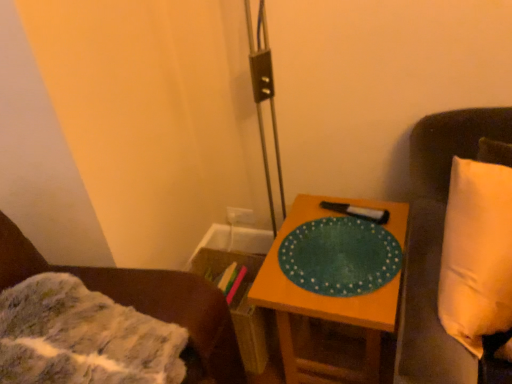
The image size is (512, 384). What are the coordinates of `white fabric pillow at right, which ranks as the second furniture in left-to-right order` in the screenshot? It's located at (437, 244).

Image resolution: width=512 pixels, height=384 pixels. I want to click on white fabric pillow at right, which is the 1th furniture in right-to-left order, so click(x=437, y=244).

Considering the sizes of objects white fabric pillow at right, which ranks as the second furniture in left-to-right order, and green matte placemat at center in the image provided, who is wider, white fabric pillow at right, which ranks as the second furniture in left-to-right order, or green matte placemat at center?

With larger width is green matte placemat at center.

Which is more to the left, white fabric pillow at right, which ranks as the second furniture in left-to-right order, or green matte placemat at center?

From the viewer's perspective, green matte placemat at center appears more on the left side.

From a real-world perspective, who is located lower, white fabric pillow at right, which ranks as the second furniture in left-to-right order, or green matte placemat at center?

green matte placemat at center is physically lower.

From the image's perspective, is white fabric pillow at right, which is the 1th furniture in right-to-left order, located above green matte placemat at center?

Yes, from the image's perspective, white fabric pillow at right, which is the 1th furniture in right-to-left order, is over green matte placemat at center.

Considering the relative sizes of fuzzy fabric blanket at lower left, which appears as the 2th furniture when viewed from the right, and green matte platter at center-right in the image provided, is fuzzy fabric blanket at lower left, which appears as the 2th furniture when viewed from the right, bigger than green matte platter at center-right?

Indeed, fuzzy fabric blanket at lower left, which appears as the 2th furniture when viewed from the right, has a larger size compared to green matte platter at center-right.

From the image's perspective, between fuzzy fabric blanket at lower left, which appears as the 2th furniture when viewed from the right, and green matte platter at center-right, who is located below?

fuzzy fabric blanket at lower left, which appears as the 2th furniture when viewed from the right, is shown below in the image.

Is fuzzy fabric blanket at lower left, which appears as the 2th furniture when viewed from the right, facing away from green matte platter at center-right?

No.

Is green matte platter at center-right not near fuzzy fabric blanket at lower left, which appears as the 2th furniture when viewed from the right?

No, green matte platter at center-right is in close proximity to fuzzy fabric blanket at lower left, which appears as the 2th furniture when viewed from the right.

Does green matte platter at center-right have a smaller size compared to fuzzy fabric blanket at lower left, which appears as the 1th furniture when viewed from the left?

Correct, green matte platter at center-right occupies less space than fuzzy fabric blanket at lower left, which appears as the 1th furniture when viewed from the left.

Is green matte platter at center-right aimed at fuzzy fabric blanket at lower left, which appears as the 1th furniture when viewed from the left?

No, green matte platter at center-right does not turn towards fuzzy fabric blanket at lower left, which appears as the 1th furniture when viewed from the left.

In terms of height, does green matte platter at center-right look taller or shorter compared to fuzzy fabric blanket at lower left, which appears as the 2th furniture when viewed from the right?

Clearly, green matte platter at center-right is shorter compared to fuzzy fabric blanket at lower left, which appears as the 2th furniture when viewed from the right.

Is green matte platter at center-right facing away from green matte placemat at center?

No, green matte placemat at center is not at the back of green matte platter at center-right.

Considering the positions of objects green matte platter at center-right and green matte placemat at center in the image provided, who is in front, green matte platter at center-right or green matte placemat at center?

green matte placemat at center is closer to the camera.

Considering the positions of objects green matte platter at center-right and green matte placemat at center in the image provided, who is more to the left, green matte platter at center-right or green matte placemat at center?

green matte platter at center-right.

Is green matte platter at center-right far away from green matte placemat at center?

That's not correct — green matte platter at center-right is a little close to green matte placemat at center.

Which object is further away from the camera, fuzzy fabric blanket at lower left, which appears as the 2th furniture when viewed from the right, or white fabric pillow at right, which is the 1th furniture in right-to-left order?

→ white fabric pillow at right, which is the 1th furniture in right-to-left order, is further away from the camera.

Between point (225, 332) and point (452, 150), which one is positioned in front?

Point (225, 332)

Between fuzzy fabric blanket at lower left, which appears as the 2th furniture when viewed from the right, and white fabric pillow at right, which ranks as the second furniture in left-to-right order, which one has more height?

Standing taller between the two is white fabric pillow at right, which ranks as the second furniture in left-to-right order.

Does fuzzy fabric blanket at lower left, which appears as the 1th furniture when viewed from the left, have a smaller size compared to white fabric pillow at right, which ranks as the second furniture in left-to-right order?

Correct, fuzzy fabric blanket at lower left, which appears as the 1th furniture when viewed from the left, occupies less space than white fabric pillow at right, which ranks as the second furniture in left-to-right order.

Which of these two, white fabric pillow at right, which ranks as the second furniture in left-to-right order, or fuzzy fabric blanket at lower left, which appears as the 1th furniture when viewed from the left, stands taller?

white fabric pillow at right, which ranks as the second furniture in left-to-right order.

Between white fabric pillow at right, which ranks as the second furniture in left-to-right order, and fuzzy fabric blanket at lower left, which appears as the 2th furniture when viewed from the right, which one appears on the right side from the viewer's perspective?

white fabric pillow at right, which ranks as the second furniture in left-to-right order.

Which is farther, (457, 141) or (180, 310)?

The point (457, 141) is farther.

Relative to fuzzy fabric blanket at lower left, which appears as the 1th furniture when viewed from the left, is white fabric pillow at right, which is the 1th furniture in right-to-left order, in front or behind?

white fabric pillow at right, which is the 1th furniture in right-to-left order, is behind fuzzy fabric blanket at lower left, which appears as the 1th furniture when viewed from the left.

Is green matte placemat at center taller than white fabric pillow at right, which ranks as the second furniture in left-to-right order?

No.

Is the position of green matte placemat at center less distant than that of white fabric pillow at right, which ranks as the second furniture in left-to-right order?

That is False.

Is white fabric pillow at right, which is the 1th furniture in right-to-left order, a part of green matte placemat at center?

Actually, white fabric pillow at right, which is the 1th furniture in right-to-left order, is outside green matte placemat at center.

Locate an element on the screen. table below the white fabric pillow at right, which ranks as the second furniture in left-to-right order (from the image's perspective) is located at coordinates (328, 297).

This screenshot has width=512, height=384. I want to click on platter located behind the fuzzy fabric blanket at lower left, which appears as the 2th furniture when viewed from the right, so click(x=340, y=256).

Looking at the image, which one is located closer to white fabric pillow at right, which is the 1th furniture in right-to-left order, green matte placemat at center or green matte platter at center-right?

Based on the image, green matte platter at center-right appears to be nearer to white fabric pillow at right, which is the 1th furniture in right-to-left order.

Estimate the real-world distances between objects in this image. Which object is closer to green matte platter at center-right, fuzzy fabric blanket at lower left, which appears as the 2th furniture when viewed from the right, or green matte placemat at center?

Based on the image, green matte placemat at center appears to be nearer to green matte platter at center-right.

Which object lies further to the anchor point green matte platter at center-right, fuzzy fabric blanket at lower left, which appears as the 2th furniture when viewed from the right, or white fabric pillow at right, which ranks as the second furniture in left-to-right order?

fuzzy fabric blanket at lower left, which appears as the 2th furniture when viewed from the right.

When comparing their distances from white fabric pillow at right, which ranks as the second furniture in left-to-right order, does green matte platter at center-right or green matte placemat at center seem further?

green matte placemat at center is further to white fabric pillow at right, which ranks as the second furniture in left-to-right order.

Considering their positions, is white fabric pillow at right, which ranks as the second furniture in left-to-right order, positioned further to green matte placemat at center than green matte platter at center-right?

Among the two, white fabric pillow at right, which ranks as the second furniture in left-to-right order, is located further to green matte placemat at center.

When comparing their distances from fuzzy fabric blanket at lower left, which appears as the 2th furniture when viewed from the right, does green matte placemat at center or white fabric pillow at right, which ranks as the second furniture in left-to-right order, seem closer?

Among the two, green matte placemat at center is located nearer to fuzzy fabric blanket at lower left, which appears as the 2th furniture when viewed from the right.

Considering their positions, is white fabric pillow at right, which ranks as the second furniture in left-to-right order, positioned closer to fuzzy fabric blanket at lower left, which appears as the 2th furniture when viewed from the right, than green matte platter at center-right?

Among the two, green matte platter at center-right is located nearer to fuzzy fabric blanket at lower left, which appears as the 2th furniture when viewed from the right.

Considering their positions, is white fabric pillow at right, which is the 1th furniture in right-to-left order, positioned further to fuzzy fabric blanket at lower left, which appears as the 2th furniture when viewed from the right, than green matte placemat at center?

Based on the image, white fabric pillow at right, which is the 1th furniture in right-to-left order, appears to be further to fuzzy fabric blanket at lower left, which appears as the 2th furniture when viewed from the right.

Image resolution: width=512 pixels, height=384 pixels. Identify the location of platter situated between fuzzy fabric blanket at lower left, which appears as the 1th furniture when viewed from the left, and green matte placemat at center from left to right. (340, 256).

This screenshot has height=384, width=512. I want to click on platter situated between fuzzy fabric blanket at lower left, which appears as the 2th furniture when viewed from the right, and white fabric pillow at right, which ranks as the second furniture in left-to-right order, from left to right, so click(340, 256).

Where is `table situated between fuzzy fabric blanket at lower left, which appears as the 1th furniture when viewed from the left, and white fabric pillow at right, which is the 1th furniture in right-to-left order, from left to right`? The image size is (512, 384). table situated between fuzzy fabric blanket at lower left, which appears as the 1th furniture when viewed from the left, and white fabric pillow at right, which is the 1th furniture in right-to-left order, from left to right is located at coordinates (328, 297).

Find the location of a particular element. table between white fabric pillow at right, which ranks as the second furniture in left-to-right order, and green matte platter at center-right from front to back is located at coordinates (328, 297).